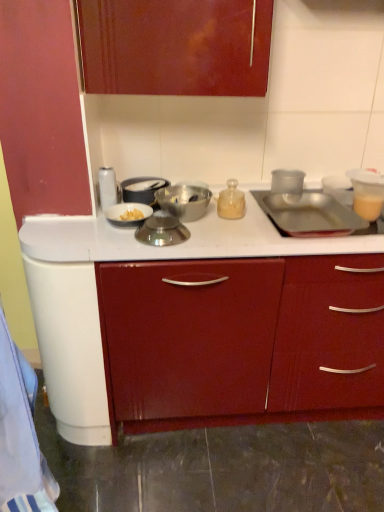
Question: Would you say translucent glass jar at center, the second kitchen appliance positioned from the right, is a long distance from metallic bowl at center, which is the fifth kitchen appliance in left-to-right order?

Choices:
 (A) no
 (B) yes

Answer: (A)

Question: From the image's perspective, is translucent glass jar at center, the second kitchen appliance positioned from the right, above metallic bowl at center, the 3th kitchen appliance viewed from the right?

Choices:
 (A) no
 (B) yes

Answer: (B)

Question: Is translucent glass jar at center, the second kitchen appliance positioned from the right, positioned before metallic bowl at center, the 3th kitchen appliance viewed from the right?

Choices:
 (A) yes
 (B) no

Answer: (B)

Question: From the image's perspective, is translucent glass jar at center, positioned as the sixth kitchen appliance in left-to-right order, under metallic bowl at center, the 3th kitchen appliance viewed from the right?

Choices:
 (A) no
 (B) yes

Answer: (A)

Question: Can you confirm if translucent glass jar at center, positioned as the sixth kitchen appliance in left-to-right order, is bigger than metallic bowl at center, which is the fifth kitchen appliance in left-to-right order?

Choices:
 (A) no
 (B) yes

Answer: (A)

Question: Considering the relative sizes of translucent glass jar at center, the second kitchen appliance positioned from the right, and metallic bowl at center, the 3th kitchen appliance viewed from the right, in the image provided, is translucent glass jar at center, the second kitchen appliance positioned from the right, wider than metallic bowl at center, the 3th kitchen appliance viewed from the right,?

Choices:
 (A) no
 (B) yes

Answer: (A)

Question: Is transparent plastic cup at upper right, the seventh kitchen appliance in the left-to-right sequence, positioned with its back to translucent glass jar at center, positioned as the sixth kitchen appliance in left-to-right order?

Choices:
 (A) no
 (B) yes

Answer: (A)

Question: Is transparent plastic cup at upper right, the seventh kitchen appliance in the left-to-right sequence, aimed at translucent glass jar at center, the second kitchen appliance positioned from the right?

Choices:
 (A) yes
 (B) no

Answer: (B)

Question: Does transparent plastic cup at upper right, which ranks as the 1th kitchen appliance in right-to-left order, have a larger size compared to translucent glass jar at center, positioned as the sixth kitchen appliance in left-to-right order?

Choices:
 (A) yes
 (B) no

Answer: (A)

Question: From a real-world perspective, is transparent plastic cup at upper right, which ranks as the 1th kitchen appliance in right-to-left order, beneath translucent glass jar at center, the second kitchen appliance positioned from the right?

Choices:
 (A) yes
 (B) no

Answer: (A)

Question: From a real-world perspective, does transparent plastic cup at upper right, the seventh kitchen appliance in the left-to-right sequence, stand above translucent glass jar at center, the second kitchen appliance positioned from the right?

Choices:
 (A) no
 (B) yes

Answer: (A)

Question: From the image's perspective, does transparent plastic cup at upper right, which ranks as the 1th kitchen appliance in right-to-left order, appear lower than translucent glass jar at center, positioned as the sixth kitchen appliance in left-to-right order?

Choices:
 (A) yes
 (B) no

Answer: (B)

Question: Is shiny metallic bowl at center, which is the 4th kitchen appliance from left to right, further to camera compared to metallic silver bowl at center, acting as the third kitchen appliance starting from the left?

Choices:
 (A) yes
 (B) no

Answer: (B)